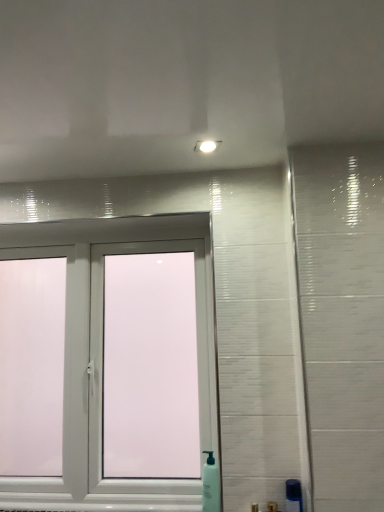
Question: From a real-world perspective, is white plastic window at center beneath green translucent soap dispenser at lower right, marked as the first soap dispenser in a right-to-left arrangement?

Choices:
 (A) no
 (B) yes

Answer: (A)

Question: Is white plastic window at center to the right of green translucent soap dispenser at lower right, the second soap dispenser when ordered from back to front, from the viewer's perspective?

Choices:
 (A) yes
 (B) no

Answer: (B)

Question: From the image's perspective, is white plastic window at center located beneath green translucent soap dispenser at lower right, acting as the second soap dispenser starting from the left?

Choices:
 (A) no
 (B) yes

Answer: (A)

Question: Is white plastic window at center closer to the viewer compared to green translucent soap dispenser at lower right, which appears as the first soap dispenser when viewed from the front?

Choices:
 (A) yes
 (B) no

Answer: (B)

Question: Is green translucent soap dispenser at lower right, the second soap dispenser when ordered from back to front, at the back of white plastic window at center?

Choices:
 (A) no
 (B) yes

Answer: (A)

Question: From the image's perspective, is white plastic window at center over green translucent soap dispenser at lower right, acting as the second soap dispenser starting from the left?

Choices:
 (A) yes
 (B) no

Answer: (A)

Question: Could you tell me if green translucent soap dispenser at lower right, the second soap dispenser when ordered from back to front, is facing white plastic window at center?

Choices:
 (A) no
 (B) yes

Answer: (A)

Question: Considering the relative sizes of green translucent soap dispenser at lower right, marked as the first soap dispenser in a right-to-left arrangement, and white plastic window at center in the image provided, is green translucent soap dispenser at lower right, marked as the first soap dispenser in a right-to-left arrangement, taller than white plastic window at center?

Choices:
 (A) yes
 (B) no

Answer: (B)

Question: Is green translucent soap dispenser at lower right, which appears as the first soap dispenser when viewed from the front, thinner than white plastic window at center?

Choices:
 (A) no
 (B) yes

Answer: (B)

Question: Is green translucent soap dispenser at lower right, the second soap dispenser when ordered from back to front, at the left side of white plastic window at center?

Choices:
 (A) no
 (B) yes

Answer: (A)

Question: Is green translucent soap dispenser at lower right, marked as the first soap dispenser in a right-to-left arrangement, smaller than white plastic window at center?

Choices:
 (A) no
 (B) yes

Answer: (B)

Question: Are green translucent soap dispenser at lower right, which appears as the first soap dispenser when viewed from the front, and white plastic window at center far apart?

Choices:
 (A) no
 (B) yes

Answer: (A)

Question: Does white plastic window at center appear on the left side of white plastic soap dispenser at lower center, arranged as the 1th soap dispenser when viewed from the back?

Choices:
 (A) yes
 (B) no

Answer: (A)